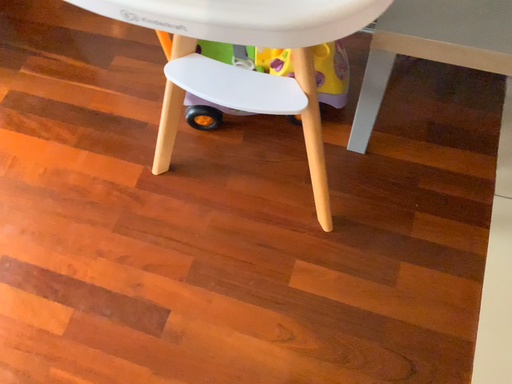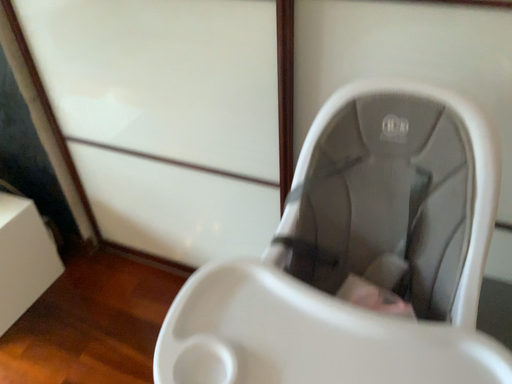
Question: Which way did the camera rotate in the video?

Choices:
 (A) rotated downward
 (B) rotated upward

Answer: (B)